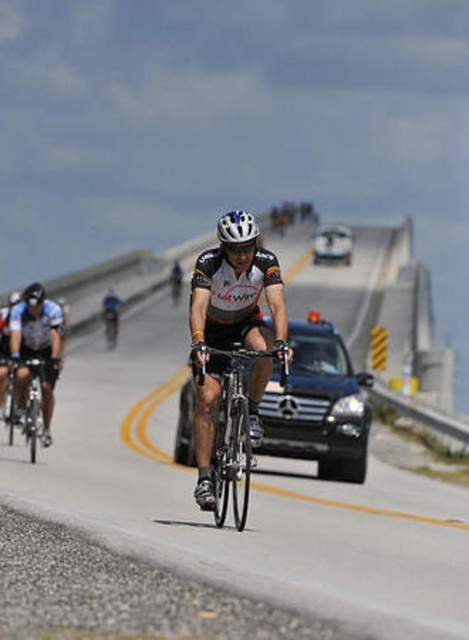
Is metallic silver bicycle at center shorter than black glossy car at center?

No.

Identify the location of metallic silver bicycle at center. (249, 500).

Locate an element on the screen. The height and width of the screenshot is (640, 469). metallic silver bicycle at center is located at coordinates (249, 500).

This screenshot has height=640, width=469. What do you see at coordinates (249, 500) in the screenshot? I see `metallic silver bicycle at center` at bounding box center [249, 500].

Between point (261, 573) and point (53, 364), which one is positioned behind?

The point (53, 364) is more distant.

Between point (414, 572) and point (29, 410), which one is positioned behind?

Point (29, 410)

Locate an element on the screen. Image resolution: width=469 pixels, height=640 pixels. metallic silver bicycle at center is located at coordinates (249, 500).

Which is behind, point (318, 248) or point (255, 220)?

Positioned behind is point (318, 248).

Between shiny black sedan at center and white matte bicycle helmet at center, which one appears on the right side from the viewer's perspective?

shiny black sedan at center is more to the right.

Measure the distance between shiny black sedan at center and camera.

shiny black sedan at center is 68.68 meters away from camera.

Where is `shiny black sedan at center`? This screenshot has height=640, width=469. shiny black sedan at center is located at coordinates (332, 244).